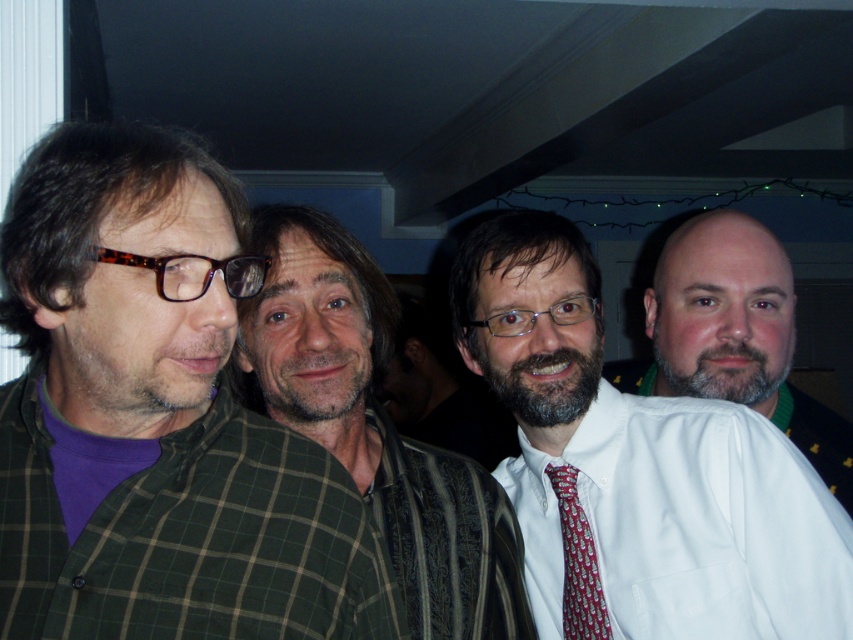
You are a photographer adjusting your camera settings to capture the scene. You notice the green plaid shirt at left and the red silk tie at center. Which object should you focus on first if you want to ensure both are in sharp focus, considering their positions?

The green plaid shirt at left is taller than the red silk tie at center, so focusing on the green plaid shirt at left will ensure both are in sharp focus as it is the farther object.

You are standing in the room and want to hand a gift to the person wearing the white smooth dress shirt at center. Based on their position, which direction should you walk to reach them?

The white smooth dress shirt at center is positioned at point 0.819 on the x axis and 0.808 on the y axis, so you should walk towards the center of the room to reach them.